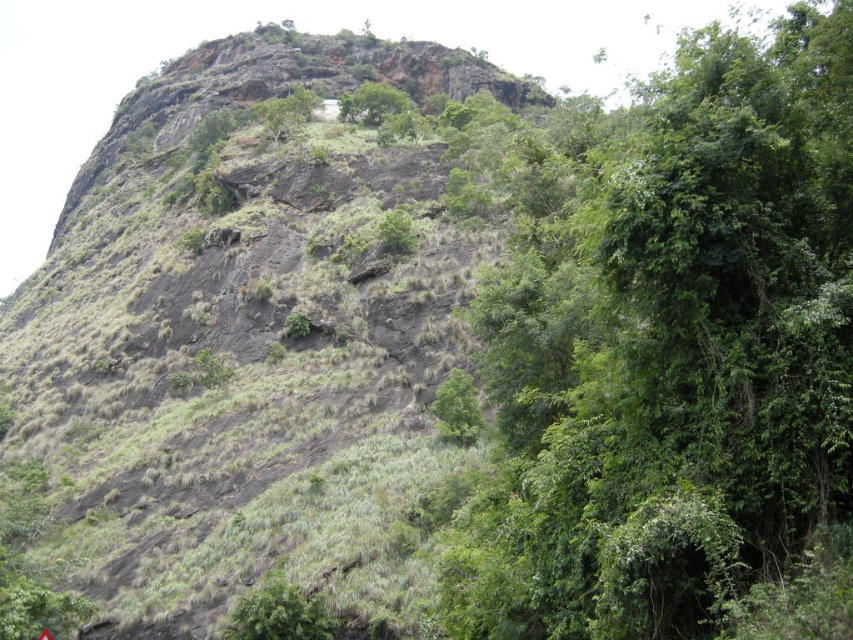
Question: Which of the following is the closest to the observer?

Choices:
 (A) (500, 486)
 (B) (96, 531)
 (C) (230, 630)

Answer: (A)

Question: Can you confirm if rugged rock mountain at upper left is smaller than green leafy tree at upper right?

Choices:
 (A) yes
 (B) no

Answer: (B)

Question: Which point is closer to the camera?

Choices:
 (A) (577, 438)
 (B) (402, 93)
 (C) (270, 628)
 (D) (125, 406)

Answer: (A)

Question: Can you confirm if green leafy tree at lower center is thinner than green leafy tree at upper center?

Choices:
 (A) no
 (B) yes

Answer: (B)

Question: Can you confirm if green leafy tree at lower center is positioned to the right of green leafy tree at upper center?

Choices:
 (A) no
 (B) yes

Answer: (B)

Question: Among these points, which one is farthest from the camera?

Choices:
 (A) (317, 628)
 (B) (392, 100)
 (C) (746, 380)

Answer: (B)